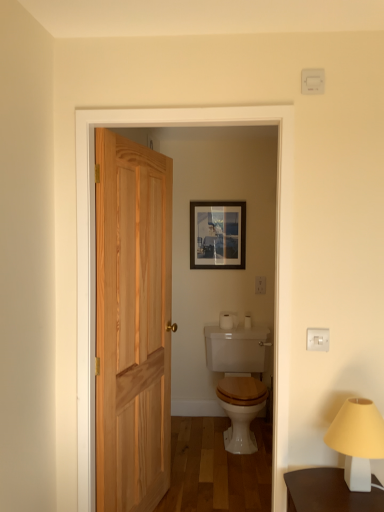
Question: From the image's perspective, does matte glass picture frame at center appear lower than natural wood screen door at center?

Choices:
 (A) yes
 (B) no

Answer: (B)

Question: From a real-world perspective, is matte glass picture frame at center located beneath natural wood screen door at center?

Choices:
 (A) yes
 (B) no

Answer: (B)

Question: Is matte glass picture frame at center not near natural wood screen door at center?

Choices:
 (A) no
 (B) yes

Answer: (B)

Question: Can you confirm if matte glass picture frame at center is taller than natural wood screen door at center?

Choices:
 (A) no
 (B) yes

Answer: (A)

Question: From the image's perspective, does matte glass picture frame at center appear higher than natural wood screen door at center?

Choices:
 (A) no
 (B) yes

Answer: (B)

Question: Is natural wood screen door at center surrounded by matte glass picture frame at center?

Choices:
 (A) yes
 (B) no

Answer: (B)

Question: Considering the relative positions of matte glass picture frame at center and white matte table lamp at lower right in the image provided, is matte glass picture frame at center to the left of white matte table lamp at lower right from the viewer's perspective?

Choices:
 (A) yes
 (B) no

Answer: (A)

Question: Is matte glass picture frame at center positioned with its back to white matte table lamp at lower right?

Choices:
 (A) no
 (B) yes

Answer: (A)

Question: Considering the relative sizes of matte glass picture frame at center and white matte table lamp at lower right in the image provided, is matte glass picture frame at center smaller than white matte table lamp at lower right?

Choices:
 (A) no
 (B) yes

Answer: (B)

Question: Is white matte table lamp at lower right surrounded by matte glass picture frame at center?

Choices:
 (A) no
 (B) yes

Answer: (A)

Question: From a real-world perspective, is matte glass picture frame at center physically above white matte table lamp at lower right?

Choices:
 (A) yes
 (B) no

Answer: (A)

Question: Is matte glass picture frame at center further to camera compared to white matte table lamp at lower right?

Choices:
 (A) no
 (B) yes

Answer: (B)

Question: Does white matte toilet paper at center have a smaller size compared to white glossy toilet at center?

Choices:
 (A) no
 (B) yes

Answer: (B)